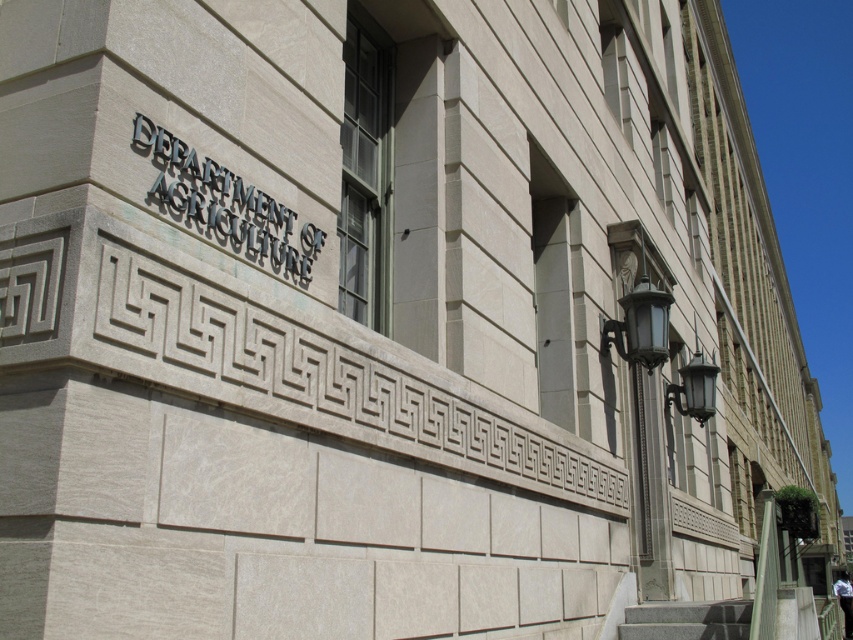
Question: Does black polished metal sign at upper center have a smaller size compared to gray granite stairs at lower right?

Choices:
 (A) yes
 (B) no

Answer: (A)

Question: Can you confirm if black polished metal sign at upper center is positioned below gray granite stairs at lower right?

Choices:
 (A) yes
 (B) no

Answer: (B)

Question: Which object appears farthest from the camera in this image?

Choices:
 (A) black polished metal sign at upper center
 (B) gray granite stairs at lower right

Answer: (B)

Question: Is black polished metal sign at upper center behind gray granite stairs at lower right?

Choices:
 (A) yes
 (B) no

Answer: (B)

Question: Which of the following is the farthest from the observer?

Choices:
 (A) black polished metal sign at upper center
 (B) gray granite stairs at lower right

Answer: (B)